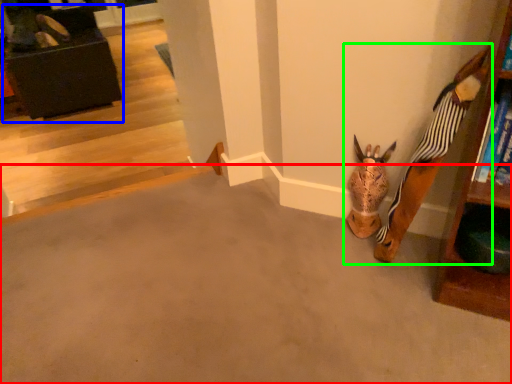
Question: Estimate the real-world distances between objects in this image. Which object is closer to concrete (highlighted by a red box), furniture (highlighted by a blue box) or toy (highlighted by a green box)?

Choices:
 (A) furniture
 (B) toy

Answer: (B)